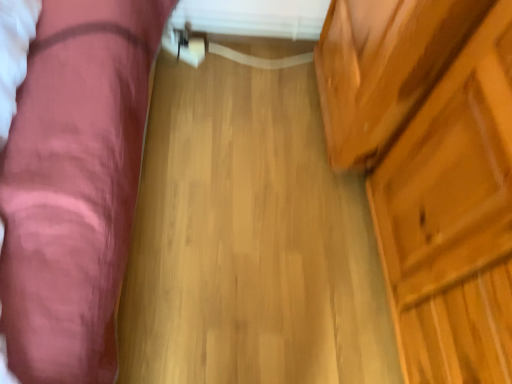
Question: Does wooden dresser at right have a smaller size compared to velvet pink couch at left?

Choices:
 (A) no
 (B) yes

Answer: (B)

Question: From the image's perspective, is wooden dresser at right below velvet pink couch at left?

Choices:
 (A) yes
 (B) no

Answer: (A)

Question: Does wooden dresser at right have a larger size compared to velvet pink couch at left?

Choices:
 (A) yes
 (B) no

Answer: (B)

Question: Can you confirm if wooden dresser at right is shorter than velvet pink couch at left?

Choices:
 (A) no
 (B) yes

Answer: (A)

Question: Is wooden dresser at right not within velvet pink couch at left?

Choices:
 (A) yes
 (B) no

Answer: (A)

Question: Can you confirm if wooden dresser at right is taller than velvet pink couch at left?

Choices:
 (A) yes
 (B) no

Answer: (A)

Question: Could you tell me if wooden dresser at right is facing natural wood floor at center?

Choices:
 (A) no
 (B) yes

Answer: (B)

Question: From a real-world perspective, is wooden dresser at right beneath natural wood floor at center?

Choices:
 (A) no
 (B) yes

Answer: (A)

Question: Does wooden dresser at right have a lesser width compared to natural wood floor at center?

Choices:
 (A) no
 (B) yes

Answer: (B)

Question: Is the position of wooden dresser at right less distant than that of natural wood floor at center?

Choices:
 (A) no
 (B) yes

Answer: (B)

Question: Considering the relative sizes of wooden dresser at right and natural wood floor at center in the image provided, is wooden dresser at right shorter than natural wood floor at center?

Choices:
 (A) no
 (B) yes

Answer: (A)

Question: Is wooden dresser at right looking in the opposite direction of natural wood floor at center?

Choices:
 (A) no
 (B) yes

Answer: (A)

Question: From a real-world perspective, is velvet pink couch at left over natural wood floor at center?

Choices:
 (A) no
 (B) yes

Answer: (B)